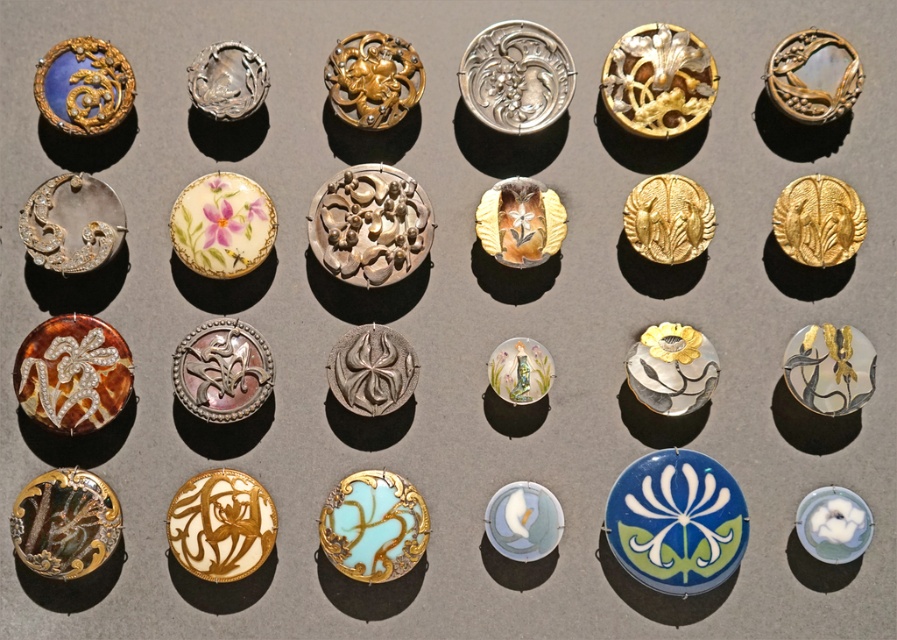
Which is above, gold textured brooch at center or gold textured leaf at upper right?

Positioned higher is gold textured brooch at center.

Is gold textured brooch at center bigger than gold textured leaf at upper right?

Yes, gold textured brooch at center is bigger than gold textured leaf at upper right.

What do you see at coordinates (372, 80) in the screenshot?
I see `gold textured brooch at center` at bounding box center [372, 80].

Find the location of a particular element. This screenshot has height=640, width=897. gold textured brooch at center is located at coordinates (372, 80).

Who is positioned more to the right, silver/golden metallic brooch at upper center or white glossy flower at lower right?

white glossy flower at lower right

Between silver/golden metallic brooch at upper center and white glossy flower at lower right, which one has more height?

silver/golden metallic brooch at upper center

Is point (198, 99) behind point (823, 509)?

Yes, point (198, 99) is farther from viewer.

Locate an element on the screen. silver/golden metallic brooch at upper center is located at coordinates (227, 81).

Does matte silver brooch at upper left have a larger size compared to gold textured leaf at center?

Indeed, matte silver brooch at upper left has a larger size compared to gold textured leaf at center.

Between point (66, 211) and point (684, 192), which one is positioned in front?

Positioned in front is point (684, 192).

I want to click on matte silver brooch at upper left, so click(72, 224).